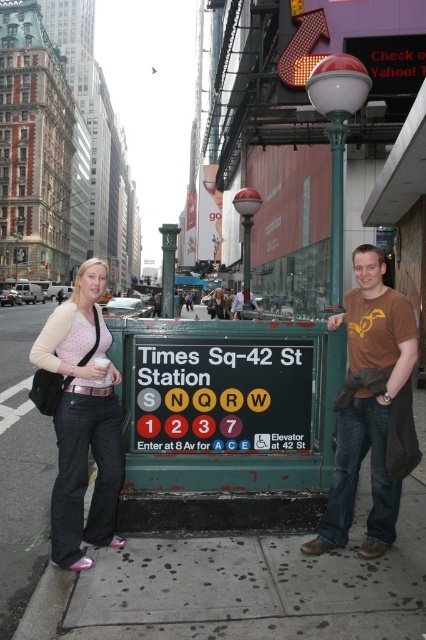
You are a delivery person carrying a heavy package and need to reach the elevator for the A, C, E subway lines. You are standing near the metallic silver streetlamp at center and the matte black jacket at center. Which direction should you move to reach the elevator entrance mentioned in the scene?

The elevator for the A, C, E lines is located at 8th Avenue, as noted below the subway lines on the station sign. Since you are near the metallic silver streetlamp at center and the matte black jacket at center, you should move towards 8th Avenue to reach the elevator entrance.

You are at the Times Sq station and need to reach the elevator for the A, C, E lines. You see two points in the station map displayed on the wall. One is at coordinate point (339, 540) and the other at point (164, 284). According to the map, which point is closer to the entrance where the elevator for the A, C, E lines is located?

Point (339, 540) is in front of point (164, 284), so the elevator for the A, C, E lines is located at the entrance near point (339, 540).

You are a tourist standing at the Times Sq station and want to take a photo with the metallic silver streetlamp at center and the matte pink shirt at center. Which object should you position closer to the camera to ensure both are in focus?

To ensure both the metallic silver streetlamp at center and the matte pink shirt at center are in focus, position the matte pink shirt at center closer to the camera since it is shorter than the streetlamp. This adjustment helps maintain depth of field for both subjects.